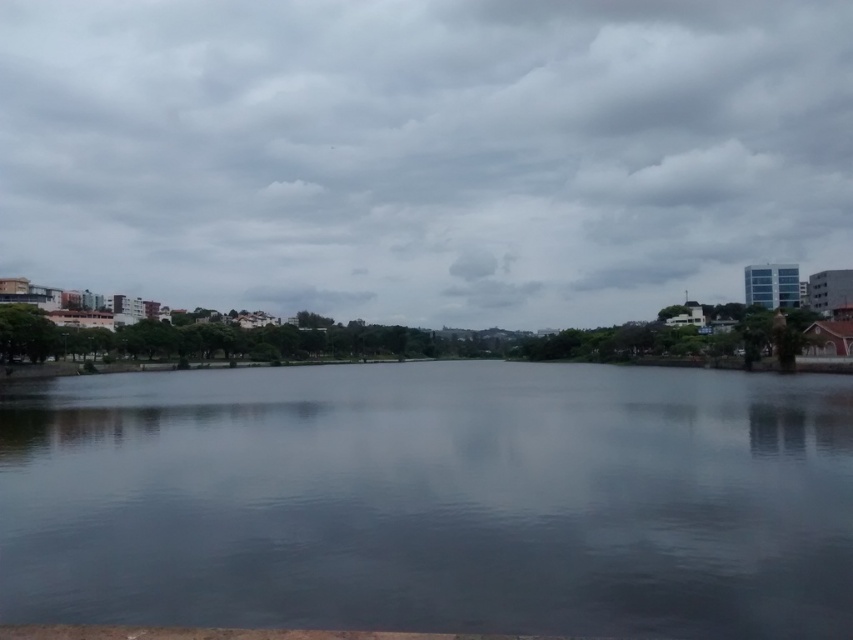
You are standing at the edge of the water in the image and looking towards the center. What is the first object you see at the coordinates point (424, 154)?

The point (424, 154) corresponds to the cloudy sky at upper center, so the first object you see at those coordinates is the cloudy sky at upper center.

You are an architect designing a new building that needs to have a clear view of the cloudy sky at upper center. Given the current layout of the scene, which object might block this view if the building is placed near the smooth water at center?

The smooth water at center could block the view of the cloudy sky at upper center because the cloudy sky at upper center is positioned over the smooth water at center, meaning the water is directly below it. If the building is placed near the water, the water itself might obstruct the upward view to the sky.